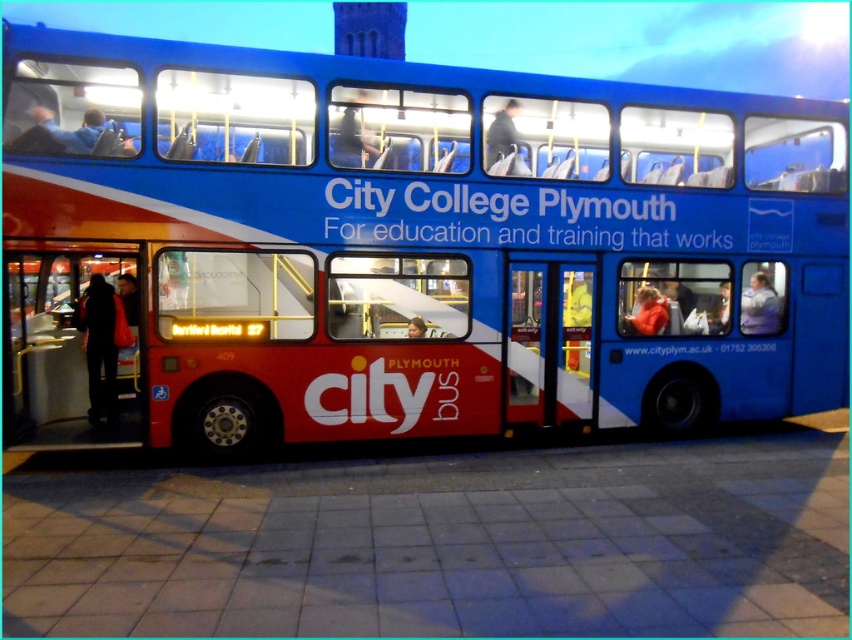
You are a delivery person needing to park your van next to the metallic red bus stop at left. The van is 2.5 meters wide. Can you park it without overlapping the blue matte bus at center?

The blue matte bus at center is wider than the metallic red bus stop at left. Since the van is 2.5 meters wide, it might not fit if the available space next to the bus stop is narrower than that. However, the exact width of the bus stop isn not provided, so we cannot confirm.

You are standing at the bus stop and want to board the blue matte bus at center. According to the coordinates provided, is the bus positioned closer to the front or the back of the stop?

The blue matte bus at center is located at point coordinates, so it is positioned at the center of the stop, neither closer to the front nor the back.

Based on the photo, you are a delivery person trying to load a tall package onto your truck. The package is 3 meters tall. You need to know if the blue matte bus at center is taller than the metallic red bus stop at left to determine if the package can pass under it. Which object is taller?

The blue matte bus at center is taller than the metallic red bus stop at left. Since the package is 3 meters tall, you need to ensure that the clearance under the bus is sufficient. However, the height comparison between the bus and the bus stop doesn